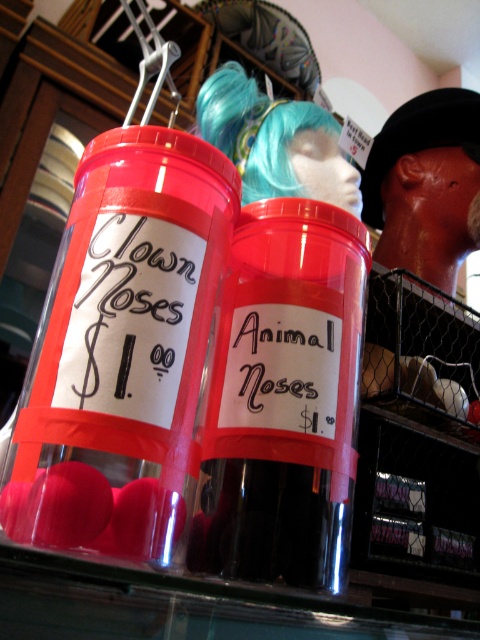
Can you confirm if matte plastic clown nose at left is taller than transparent plastic container at center?

No, matte plastic clown nose at left is not taller than transparent plastic container at center.

Does point (178, 228) come closer to viewer compared to point (213, 468)?

That is True.

Locate an element on the screen. The image size is (480, 640). matte plastic clown nose at left is located at coordinates (122, 348).